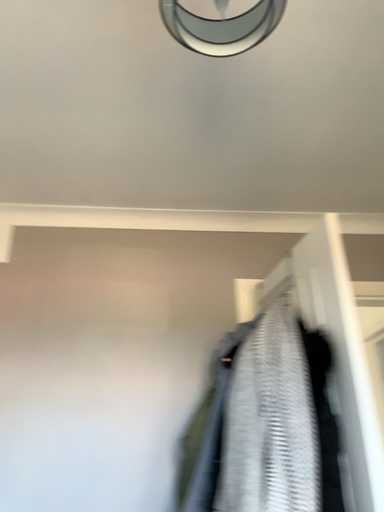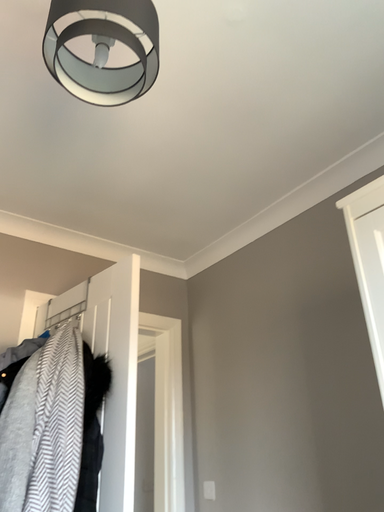
Question: How did the camera likely rotate when shooting the video?

Choices:
 (A) rotated left
 (B) rotated right

Answer: (B)